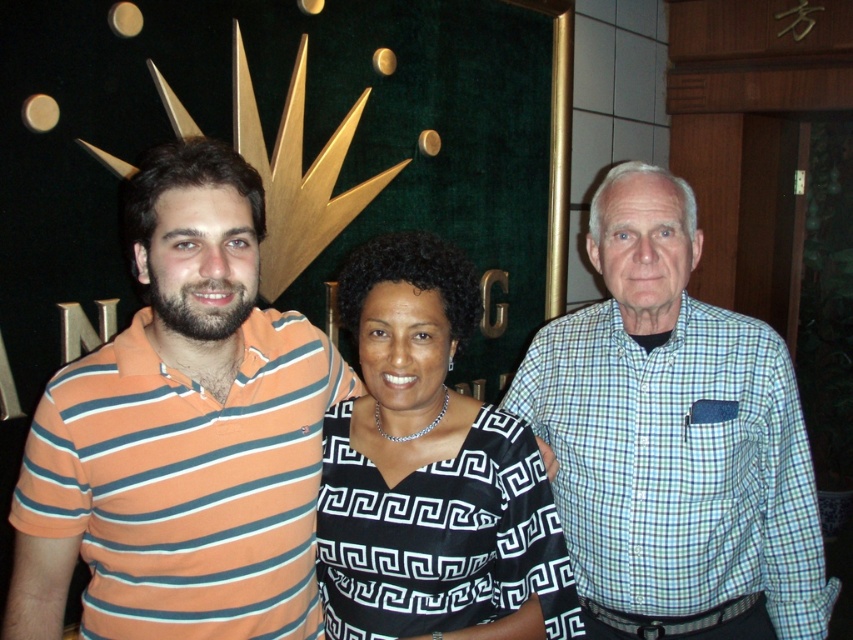
Question: Which point is farther to the camera?

Choices:
 (A) light blue checkered shirt at center
 (B) orange striped polo shirt at left
 (C) black silk dress at center

Answer: (A)

Question: Which object is farther from the camera taking this photo?

Choices:
 (A) orange striped polo shirt at left
 (B) black silk dress at center

Answer: (B)

Question: Does orange striped polo shirt at left appear under black silk dress at center?

Choices:
 (A) yes
 (B) no

Answer: (B)

Question: Observing the image, what is the correct spatial positioning of orange striped polo shirt at left in reference to light blue checkered shirt at center?

Choices:
 (A) left
 (B) right

Answer: (A)

Question: Is light blue checkered shirt at center to the right of black silk dress at center from the viewer's perspective?

Choices:
 (A) yes
 (B) no

Answer: (A)

Question: Which object is closer to the camera taking this photo?

Choices:
 (A) black silk dress at center
 (B) orange striped polo shirt at left

Answer: (B)